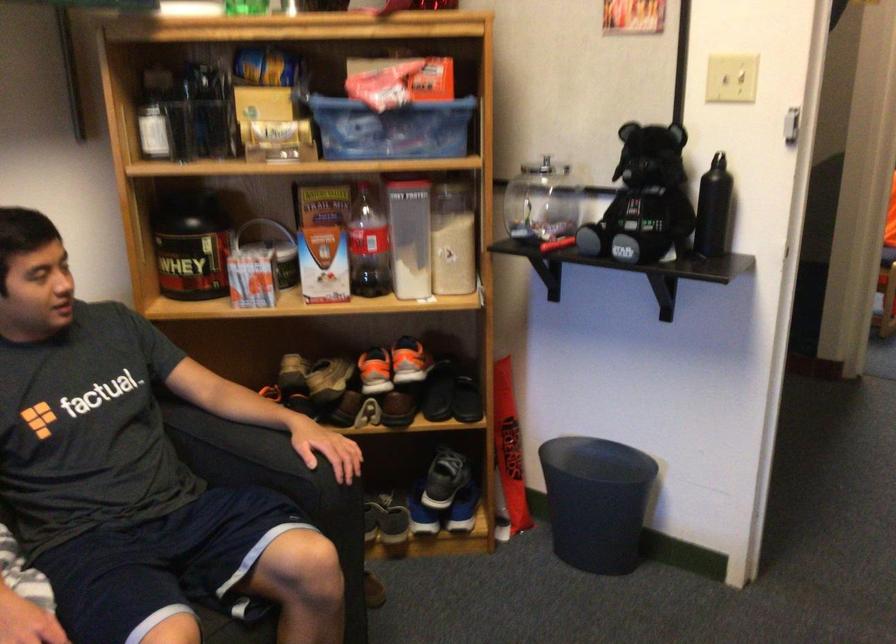
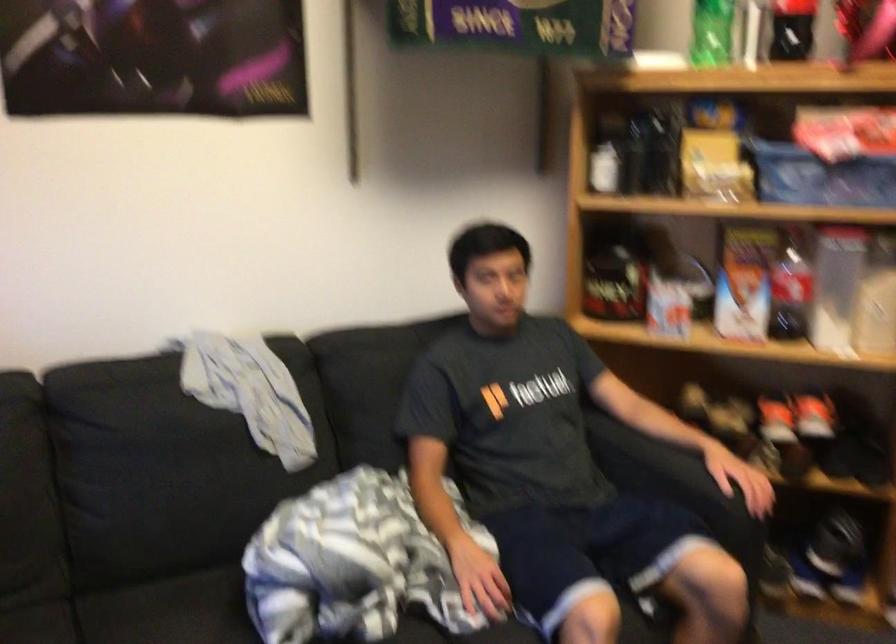
Question: The camera is either moving clockwise (left) or counter-clockwise (right) around the object. The first image is from the beginning of the video and the second image is from the end. Is the camera moving left or right when shooting the video?

Choices:
 (A) Left
 (B) Right

Answer: (B)